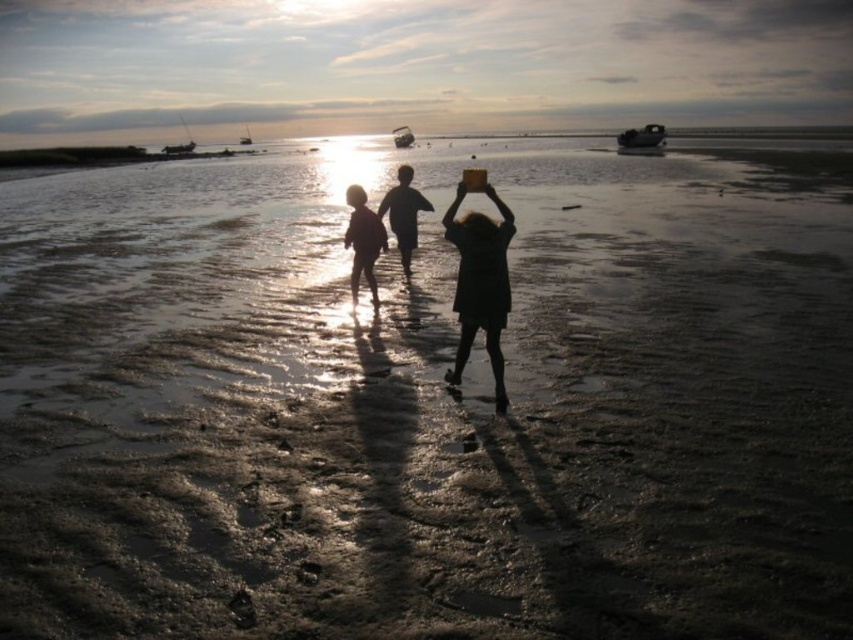
Question: Which point is farther to the camera?

Choices:
 (A) metallic gray boat at upper right
 (B) silhouette fabric child at center
 (C) metallic silver boat at center

Answer: (C)

Question: Which object is farther from the camera taking this photo?

Choices:
 (A) black matte dress at center
 (B) metallic gray boat at upper right
 (C) silhouette fabric child at center

Answer: (B)

Question: Does silhouette fabric child at center appear on the right side of metallic gray boat at upper right?

Choices:
 (A) yes
 (B) no

Answer: (B)

Question: Does silhouette fabric child at center have a greater width compared to metallic silver boat at center?

Choices:
 (A) no
 (B) yes

Answer: (A)

Question: Which point is closer to the camera?

Choices:
 (A) metallic gray boat at upper right
 (B) metallic silver boat at upper left

Answer: (A)

Question: Can you confirm if silhouette fabric child at center is positioned above metallic silver boat at upper left?

Choices:
 (A) yes
 (B) no

Answer: (B)